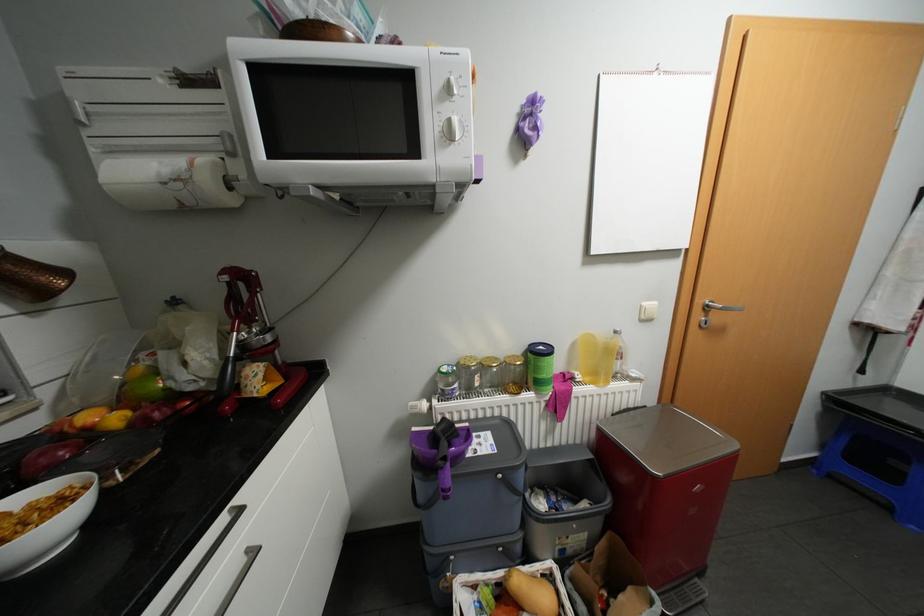
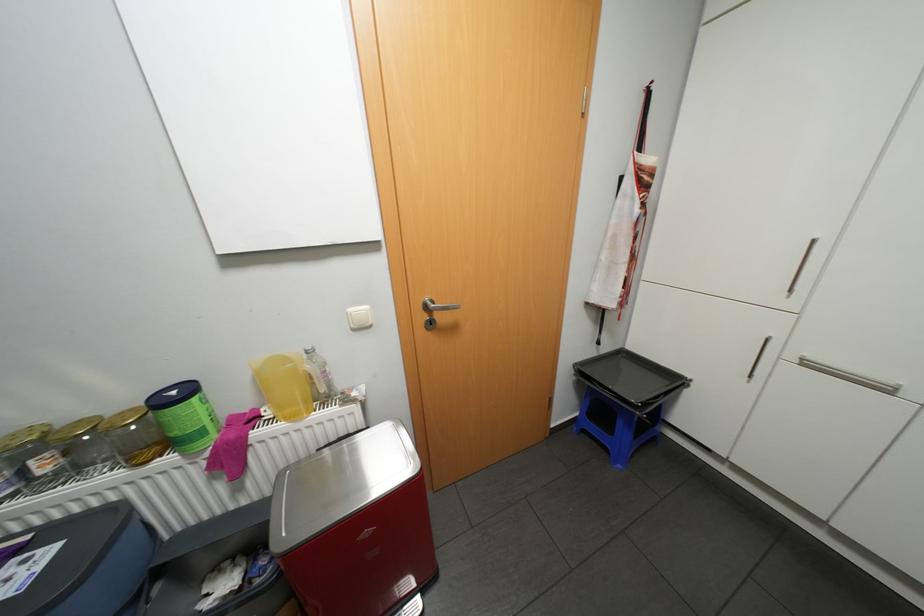
Locate, in the second image, the point that corresponds to (x=495, y=357) in the first image.

(88, 419)